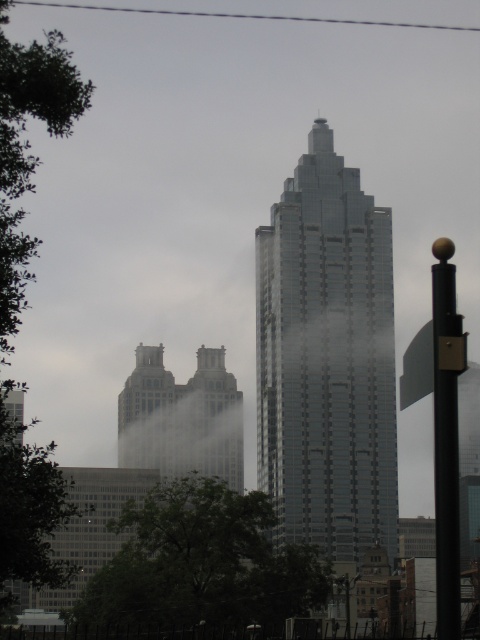
From the picture: Is glassy steel skyscraper at center smaller than black metal pole at right?

No.

Where is `glassy steel skyscraper at center`? This screenshot has height=640, width=480. glassy steel skyscraper at center is located at coordinates (326, 358).

Is point (278, 509) behind point (146, 444)?

No.

Between point (343, 276) and point (146, 442), which one is positioned behind?

The point (146, 442) is behind.

At what (x,y) coordinates should I click in order to perform the action: click on glassy steel skyscraper at center. Please return your answer as a coordinate pair (x, y). The width and height of the screenshot is (480, 640). Looking at the image, I should click on (326, 358).

Is matte silver twin towers at center shorter than black metal pole at right?

No, matte silver twin towers at center is not shorter than black metal pole at right.

In the scene shown: Who is shorter, matte silver twin towers at center or black metal pole at right?

With less height is black metal pole at right.

The image size is (480, 640). I want to click on matte silver twin towers at center, so [x=181, y=419].